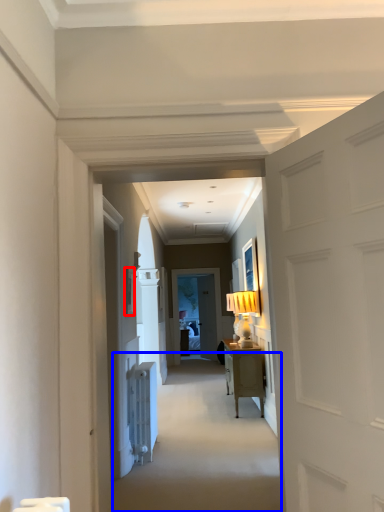
Question: Among these objects, which one is nearest to the camera, picture frame (highlighted by a red box) or path (highlighted by a blue box)?

Choices:
 (A) picture frame
 (B) path

Answer: (B)